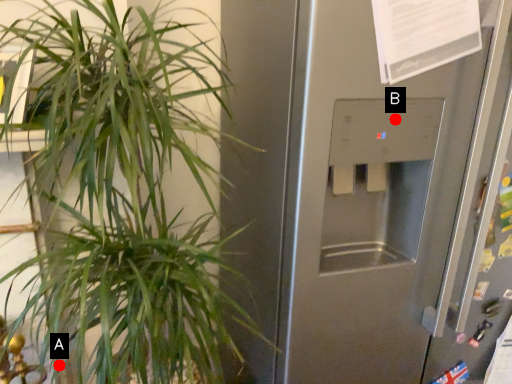
Question: Two points are circled on the image, labeled by A and B beside each circle. Which point is closer to the camera?

Choices:
 (A) A is closer
 (B) B is closer

Answer: (B)